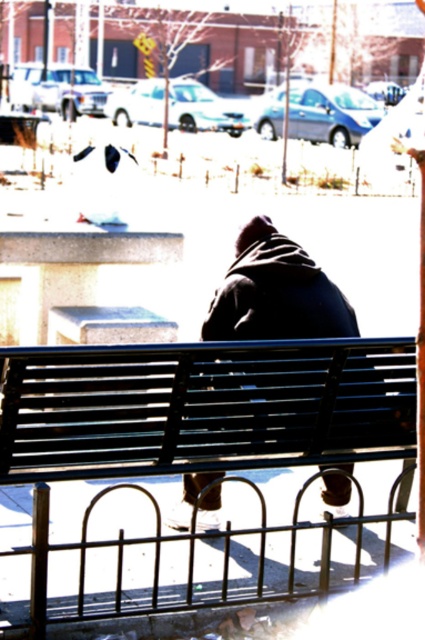
Consider the image. You are a photographer trying to capture a wide shot of the black metal bench at center and the dark blue jacket at center. Since you want both objects to be clearly visible in the frame, which one should you focus on first to ensure proper depth of field?

The black metal bench at center is bigger than the dark blue jacket at center, so focusing on the larger object first will help ensure both are in focus.

You are a pedestrian standing at the edge of the parking lot. You see a black metal bench at center and a dark blue jacket at center. Which object is closer to the ground?

The black metal bench at center is closer to the ground because it is positioned below the dark blue jacket at center.

You are standing at the origin point of the coordinate system. The black metal bench at center is located at point 0.661, 0.452. If you want to walk directly to the bench, which direction should you head?

The black metal bench at center is located at point (192, 422), so you should head northeast to reach it.